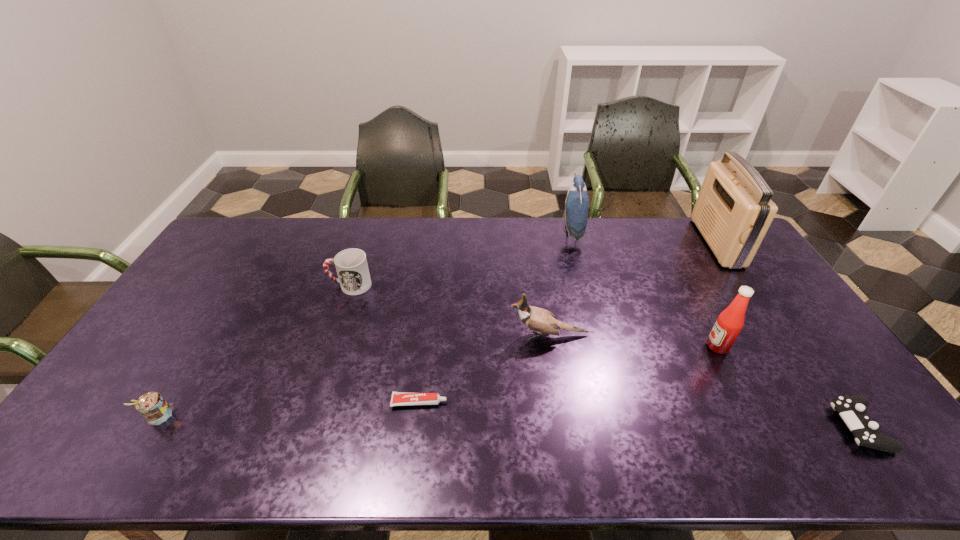
Locate an element on the screen. The height and width of the screenshot is (540, 960). the tallest object is located at coordinates (733, 211).

Find the location of a particular element. The image size is (960, 540). the taller bird is located at coordinates (577, 201).

Identify the location of condiment. This screenshot has width=960, height=540. (730, 322).

Image resolution: width=960 pixels, height=540 pixels. I want to click on the fourth tallest object, so click(x=541, y=320).

This screenshot has width=960, height=540. Find the location of `the shorter bird`. the shorter bird is located at coordinates point(541,320).

At what (x,y) coordinates should I click in order to perform the action: click on the fourth shortest object. Please return your answer as a coordinate pair (x, y). The width and height of the screenshot is (960, 540). Looking at the image, I should click on (351, 265).

Locate an element on the screen. the second object from left to right is located at coordinates (351, 265).

Where is `the third shortest object`? The height and width of the screenshot is (540, 960). the third shortest object is located at coordinates (152, 406).

Where is `the leftmost object`? The height and width of the screenshot is (540, 960). the leftmost object is located at coordinates (152, 406).

Where is `the seventh tallest object`? This screenshot has height=540, width=960. the seventh tallest object is located at coordinates (852, 409).